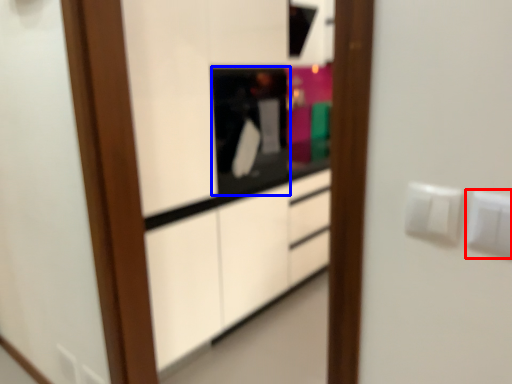
Question: Which object is closer to the camera taking this photo, electric outlet (highlighted by a red box) or appliance (highlighted by a blue box)?

Choices:
 (A) electric outlet
 (B) appliance

Answer: (A)